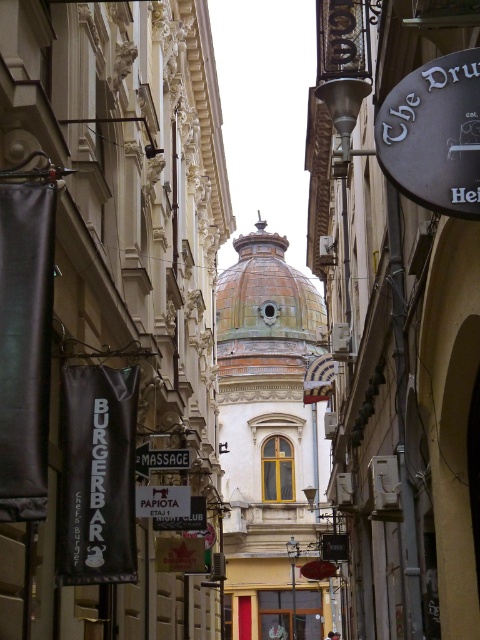
Question: Is black rubber sign at upper right behind brown tiled dome at center?

Choices:
 (A) no
 (B) yes

Answer: (A)

Question: Is black rubber sign at upper right below brown tiled dome at center?

Choices:
 (A) no
 (B) yes

Answer: (B)

Question: Is black rubber sign at upper right below brown tiled dome at center?

Choices:
 (A) no
 (B) yes

Answer: (B)